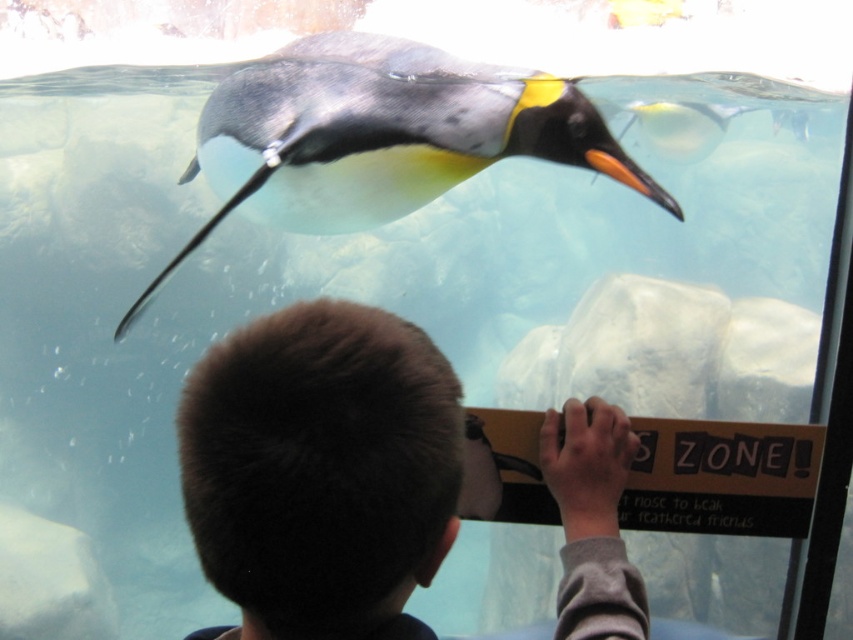
Question: Which of the following is the closest to the observer?

Choices:
 (A) short brown hair at lower center
 (B) black glossy penguin at upper center

Answer: (A)

Question: Does short brown hair at lower center have a lesser width compared to black glossy penguin at upper center?

Choices:
 (A) no
 (B) yes

Answer: (B)

Question: Which object is closer to the camera taking this photo?

Choices:
 (A) short brown hair at lower center
 (B) black glossy penguin at upper center

Answer: (A)

Question: Which object appears farthest from the camera in this image?

Choices:
 (A) black glossy penguin at upper center
 (B) short brown hair at lower center

Answer: (A)

Question: Can you confirm if short brown hair at lower center is positioned below black glossy penguin at upper center?

Choices:
 (A) no
 (B) yes

Answer: (B)

Question: Does short brown hair at lower center have a lesser width compared to black glossy penguin at upper center?

Choices:
 (A) yes
 (B) no

Answer: (A)